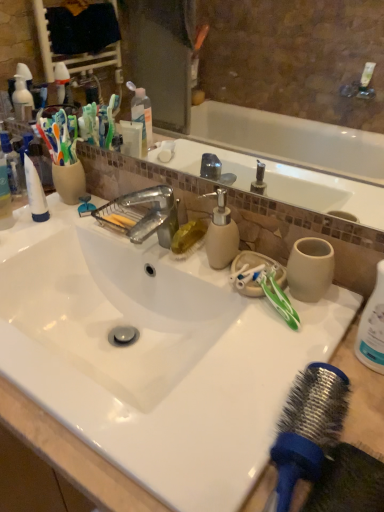
Locate an element on the screen. free space in front of green plastic toothbrush at right is located at coordinates (282, 395).